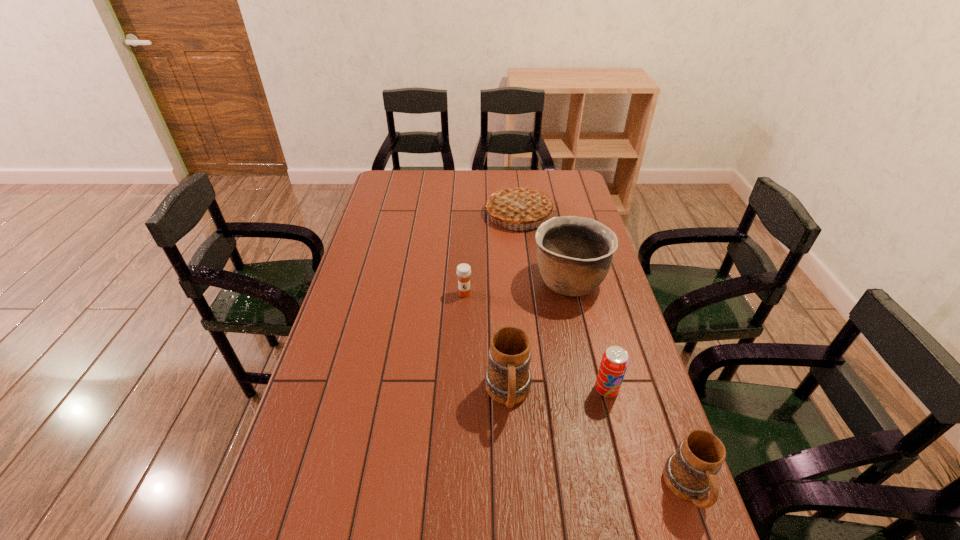
With all mugs evenly spaced, where should an extra mug be placed on the left to continue the pattern? Please point out a vacant space. Please provide its 2D coordinates. Your answer should be formatted as a tuple, i.e. [(x, y)], where the tuple contains the x and y coordinates of a point satisfying the conditions above.

[(378, 326)]